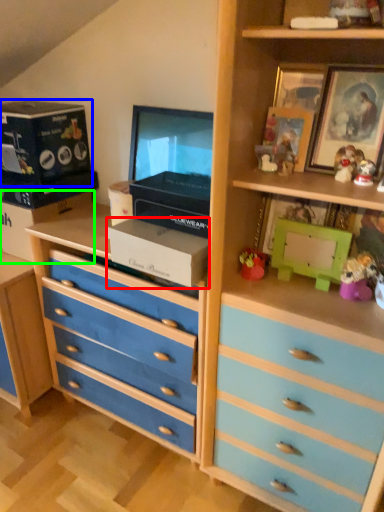
Question: Estimate the real-world distances between objects in this image. Which object is farther from box (highlighted by a red box), box (highlighted by a blue box) or box (highlighted by a green box)?

Choices:
 (A) box
 (B) box

Answer: (A)